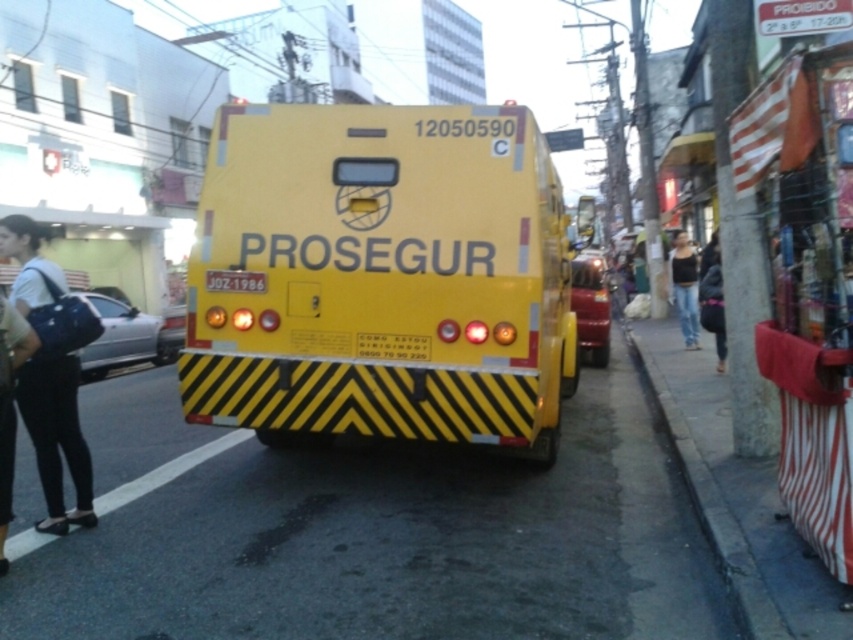
Is yellow matte truck at center to the right of yellow reflective license plate at center from the viewer's perspective?

Correct, you'll find yellow matte truck at center to the right of yellow reflective license plate at center.

Who is shorter, yellow matte truck at center or yellow reflective license plate at center?

Standing shorter between the two is yellow reflective license plate at center.

Between point (496, 353) and point (368, 332), which one is positioned in front?

Positioned in front is point (496, 353).

I want to click on yellow matte truck at center, so click(380, 276).